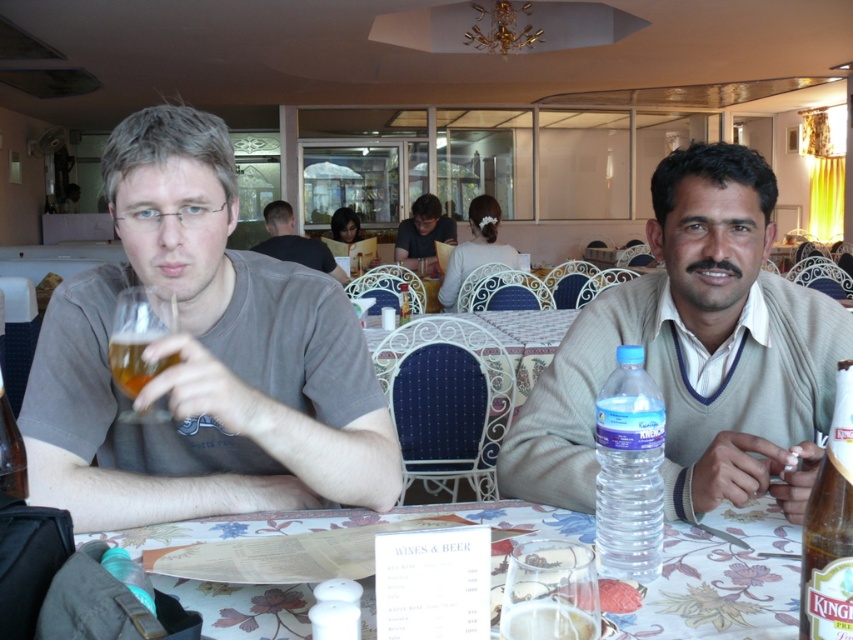
Who is more forward, (322,257) or (403,292)?

Positioned in front is point (403,292).

Does dark gray shirt at center appear over clear glass bottle at center?

Yes, dark gray shirt at center is above clear glass bottle at center.

This screenshot has height=640, width=853. Describe the element at coordinates (294, 243) in the screenshot. I see `dark gray shirt at center` at that location.

In order to click on dark gray shirt at center in this screenshot , I will do `click(294, 243)`.

Between golden amber liquid at glass left and translucent glass at table center, which one has more height?

golden amber liquid at glass left is taller.

Locate an element on the screen. Image resolution: width=853 pixels, height=640 pixels. golden amber liquid at glass left is located at coordinates (138, 337).

Can you confirm if matte gray shirt at left is positioned above amber glass beer at left?

Yes, matte gray shirt at left is above amber glass beer at left.

Who is more forward, (x=210, y=362) or (x=164, y=362)?

Point (x=164, y=362)

Between point (372, 492) and point (132, 397), which one is positioned in front?

Point (372, 492) is more forward.

Where is `matte gray shirt at left`? matte gray shirt at left is located at coordinates (202, 358).